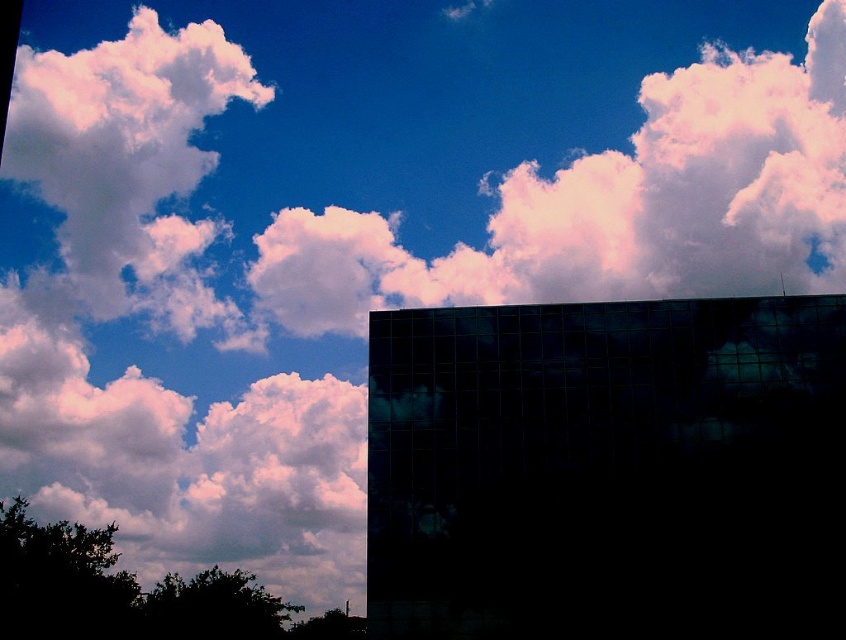
You are standing in front of the modern glass building and want to determine the spatial relationship between two points marked on the structure. The first point is at coordinate point (832, 164), and the second is at point (107, 129). Which point is closer to your vantage point?

Point (832, 164) is further to the viewer than point (107, 129), so the point at (107, 129) is closer to your vantage point.

You are standing in front of the dark, reflective glass building at lower right and want to look at the white fluffy cloud at upper center. In which direction should you look relative to the building?

You should look upwards and towards the center from the dark, reflective glass building at lower right to see the white fluffy cloud at upper center, as it is located at point (614, 205).

You are a drone operator planning to fly a drone between the two white fluffy clouds. The drone has a maximum flight distance of 37 meters. Based on the scene, can the drone safely travel between the white fluffy cloud at upper center and the white fluffy cloud at upper left without exceeding its range?

The distance between the white fluffy cloud at upper center and the white fluffy cloud at upper left is 36.99 meters, which is within the drone operator maximum flight distance of 37 meters. The drone can safely travel between them.